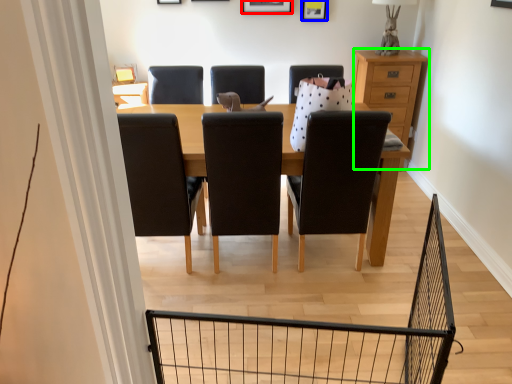
Question: Estimate the real-world distances between objects in this image. Which object is farther from picture frame (highlighted by a red box), picture frame (highlighted by a blue box) or chest of drawers (highlighted by a green box)?

Choices:
 (A) picture frame
 (B) chest of drawers

Answer: (B)